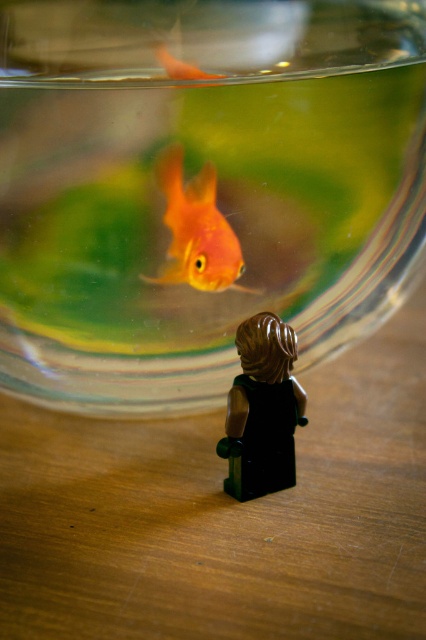
Can you confirm if shiny orange fish at center is wider than orange matte/glossy goldfish at upper center?

Correct, the width of shiny orange fish at center exceeds that of orange matte/glossy goldfish at upper center.

Between shiny orange fish at center and orange matte/glossy goldfish at upper center, which one has less height?

orange matte/glossy goldfish at upper center

Where is `shiny orange fish at center`? The height and width of the screenshot is (640, 426). shiny orange fish at center is located at coordinates (196, 230).

The image size is (426, 640). Find the location of `shiny orange fish at center`. shiny orange fish at center is located at coordinates (196, 230).

Which of these two, transparent glass bowl at center or orange matte/glossy goldfish at upper center, stands shorter?

Standing shorter between the two is orange matte/glossy goldfish at upper center.

Does transparent glass bowl at center appear under orange matte/glossy goldfish at upper center?

Correct, transparent glass bowl at center is located below orange matte/glossy goldfish at upper center.

Between point (25, 211) and point (184, 67), which one is positioned in front?

Point (184, 67) is more forward.

Locate an element on the screen. Image resolution: width=426 pixels, height=640 pixels. transparent glass bowl at center is located at coordinates (201, 188).

Who is more forward, (411, 33) or (210, 180)?

Point (210, 180) is in front.

Can you confirm if transparent glass bowl at center is bigger than shiny orange fish at center?

Yes, transparent glass bowl at center is bigger than shiny orange fish at center.

Is point (95, 52) closer to camera compared to point (198, 273)?

Yes, it is.

Find the location of a particular element. This screenshot has height=640, width=426. transparent glass bowl at center is located at coordinates (201, 188).